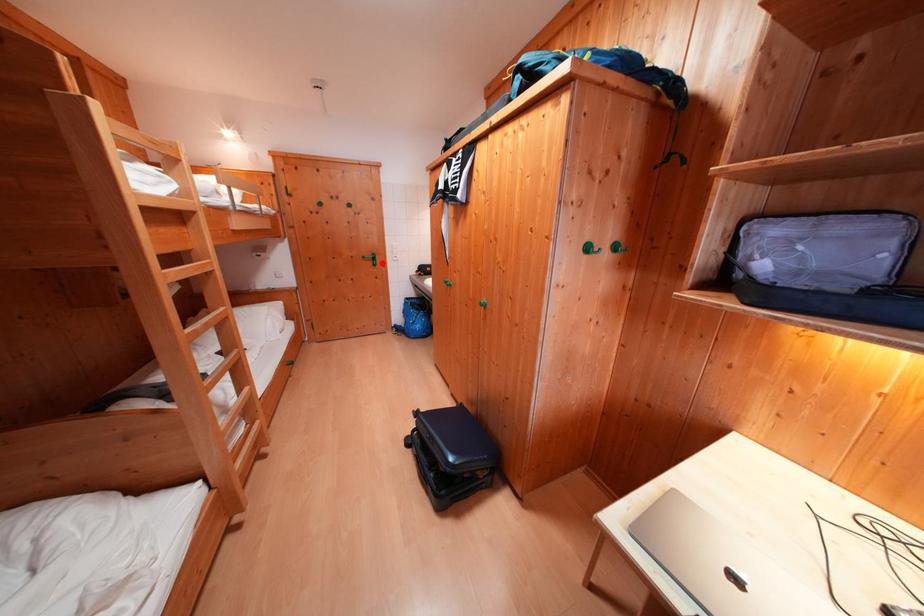
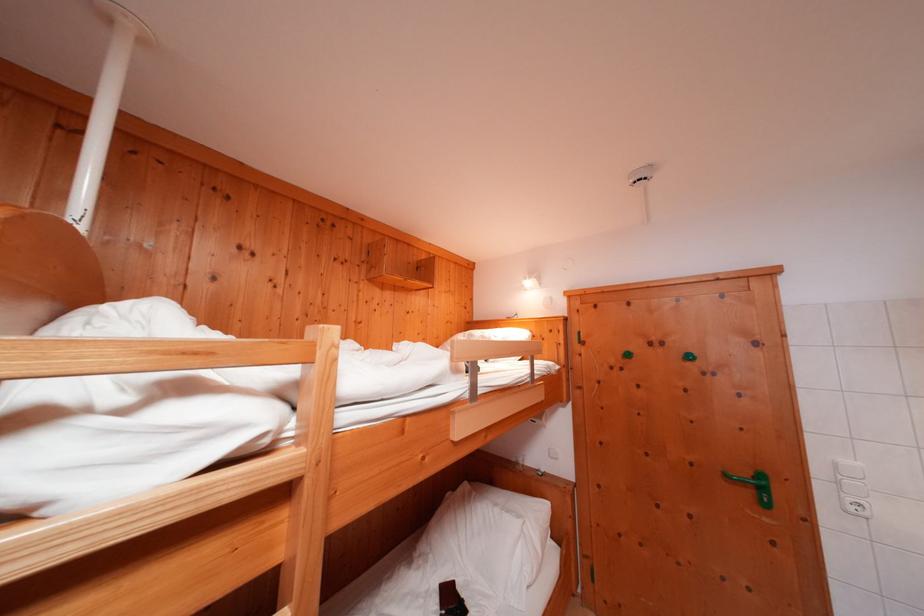
The point at the highlighted location is marked in the first image. Where is the corresponding point in the second image?

(771, 493)